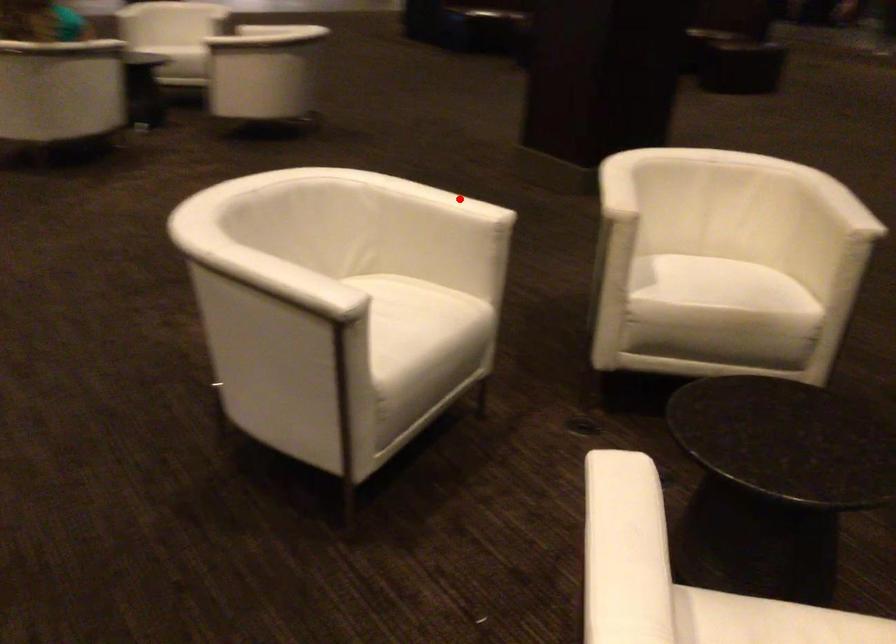
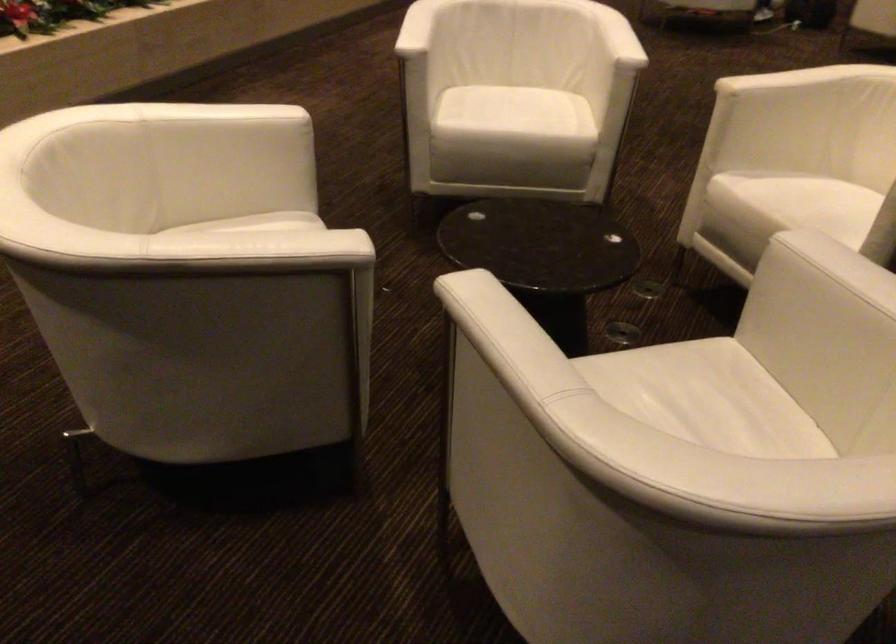
Locate, in the second image, the point that corresponds to the highlighted location in the first image.

(617, 37)